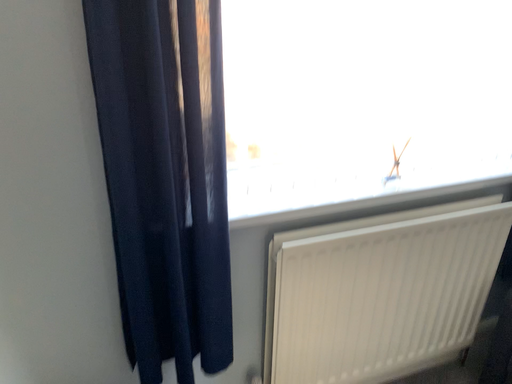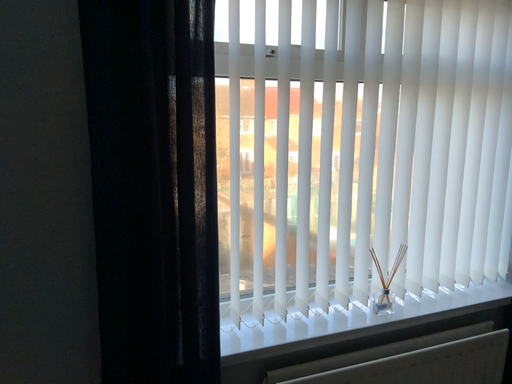
Question: How did the camera likely rotate when shooting the video?

Choices:
 (A) rotated upward
 (B) rotated downward

Answer: (A)